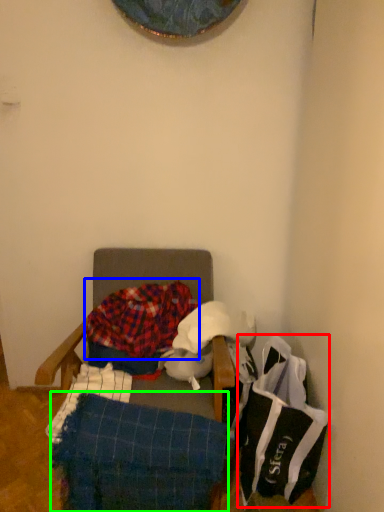
Question: Which object is positioned farthest from material (highlighted by a red box)? Select from blanket (highlighted by a blue box) and blanket (highlighted by a green box).

Choices:
 (A) blanket
 (B) blanket

Answer: (A)